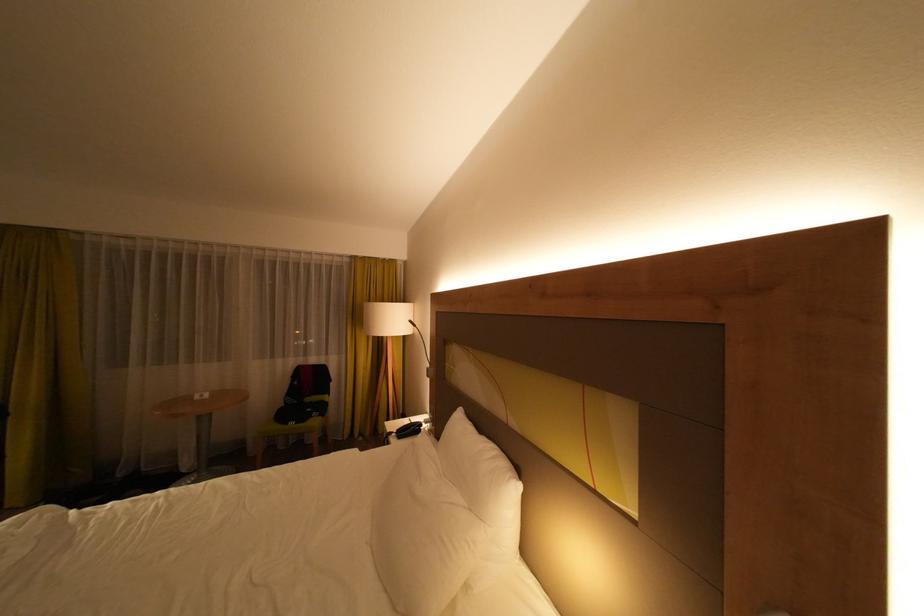
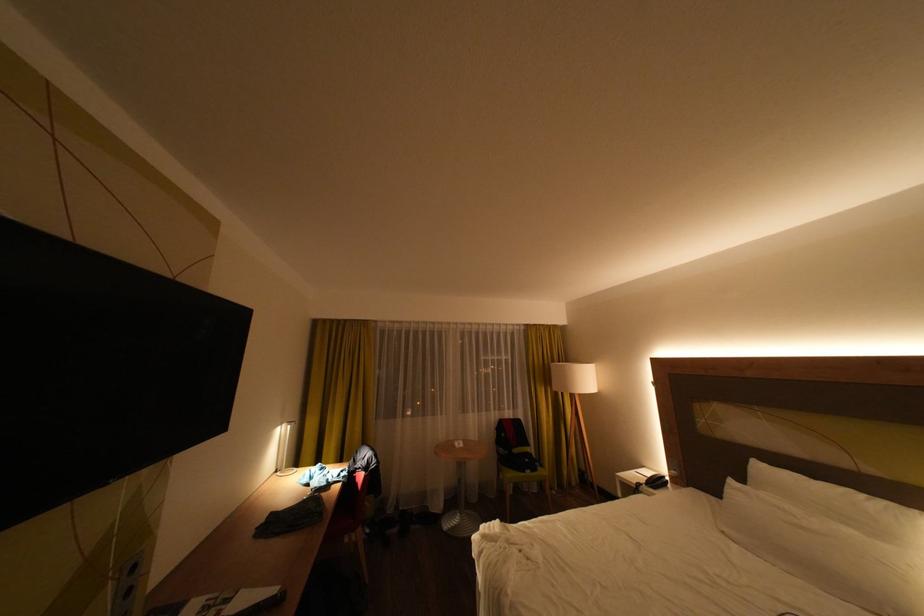
Where in the second image is the point corresponding to [320,410] from the first image?

(538, 460)